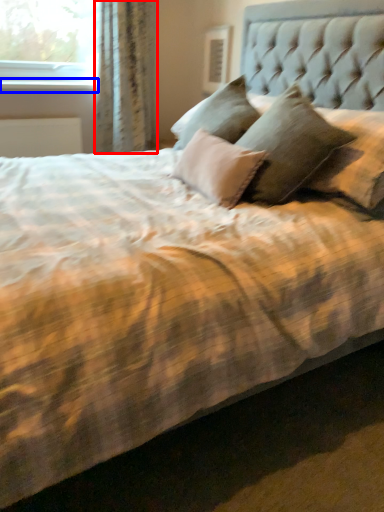
Question: Which object is further to the camera taking this photo, curtain (highlighted by a red box) or window sill (highlighted by a blue box)?

Choices:
 (A) curtain
 (B) window sill

Answer: (B)